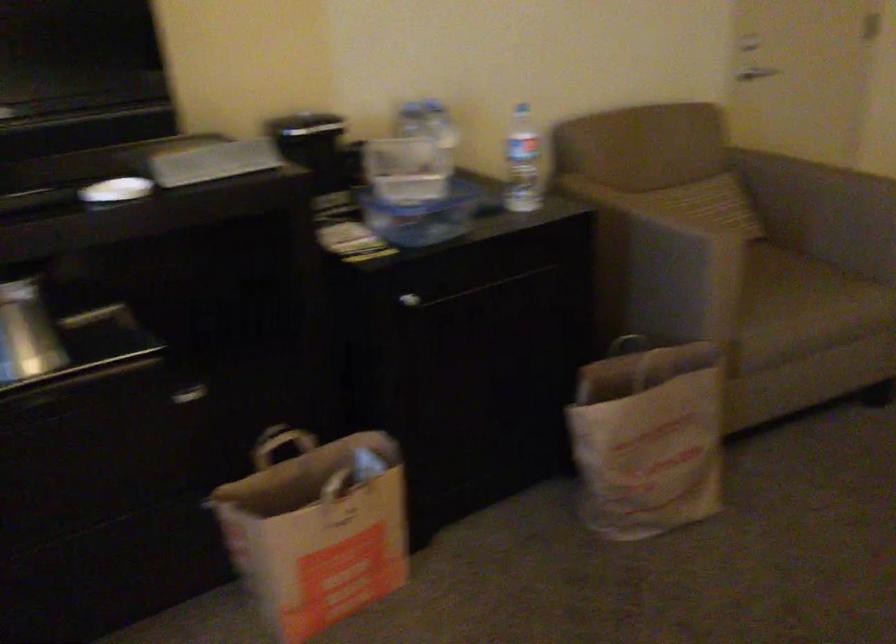
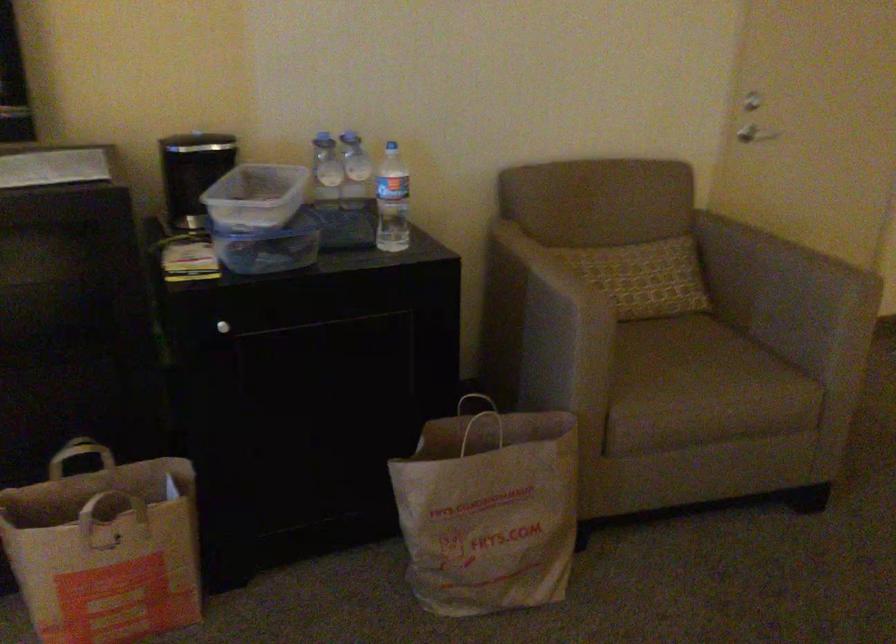
Where in the second image is the point corresponding to pixel 403 299 from the first image?

(222, 327)